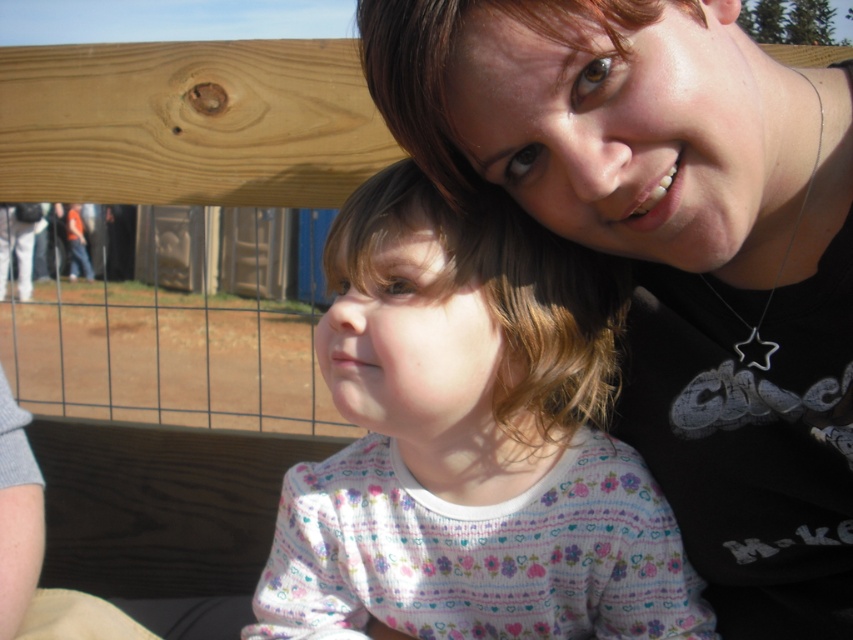
You are taking a photo of the two people in the scene. You want to focus on the point that is closer to the camera. Which point should you choose between point (627, 182) and point (383, 272)?

Point (627, 182) is closer to the camera than point (383, 272), so you should choose point (627, 182) to focus on.